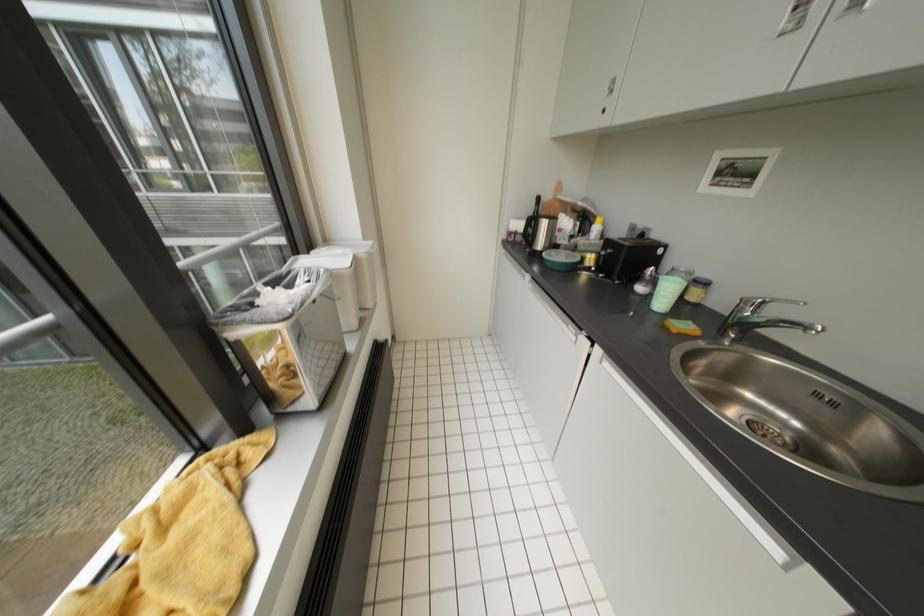
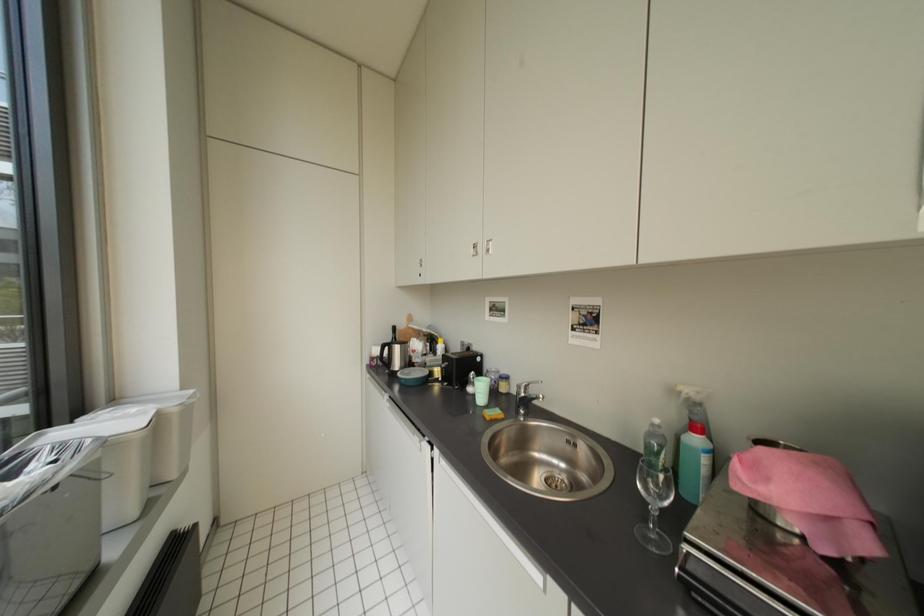
The images are taken continuously from a first-person perspective. In which direction is your viewpoint rotating?

The camera rotated toward right-up.